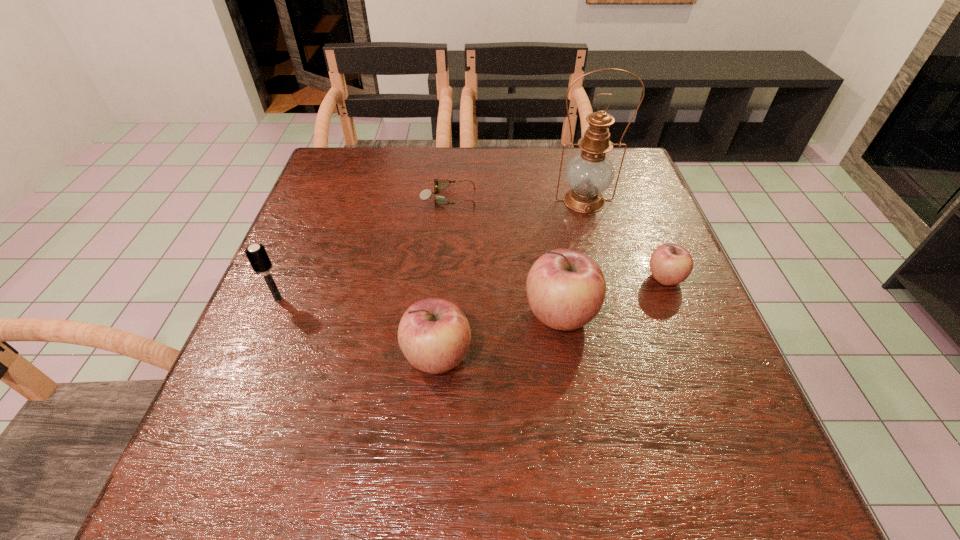
Locate an element on the screen. The height and width of the screenshot is (540, 960). empty space that is in between the tallest object and the shortest apple is located at coordinates [624, 240].

Find the location of `vacant space that is in between the leftmost object and the shortest object`. vacant space that is in between the leftmost object and the shortest object is located at coordinates (363, 248).

You are a GUI agent. You are given a task and a screenshot of the screen. Output one action in this format:
    pyautogui.click(x=<x>, y=<y>)
    Task: Click on the unoccupied position between the leftmost apple and the second apple from right to left
    The height and width of the screenshot is (540, 960).
    Given the screenshot: What is the action you would take?
    pyautogui.click(x=498, y=336)

In order to click on empty space that is in between the leftmost object and the spectacles in this screenshot , I will do `click(363, 248)`.

You are a GUI agent. You are given a task and a screenshot of the screen. Output one action in this format:
    pyautogui.click(x=<x>, y=<y>)
    Task: Click on the vacant region between the tallest object and the second shortest apple
    Image resolution: width=960 pixels, height=540 pixels.
    Given the screenshot: What is the action you would take?
    pyautogui.click(x=511, y=279)

Identify which object is the fourth closest to the rightmost object. Please provide its 2D coordinates. Your answer should be formatted as a tuple, i.e. [(x, y)], where the tuple contains the x and y coordinates of a point satisfying the conditions above.

[(426, 193)]

Point out which object is positioned as the third nearest to the rightmost apple. Please provide its 2D coordinates. Your answer should be formatted as a tuple, i.e. [(x, y)], where the tuple contains the x and y coordinates of a point satisfying the conditions above.

[(434, 334)]

Choose which apple is the nearest neighbor to the second apple from left to right. Please provide its 2D coordinates. Your answer should be formatted as a tuple, i.e. [(x, y)], where the tuple contains the x and y coordinates of a point satisfying the conditions above.

[(434, 334)]

This screenshot has height=540, width=960. What are the coordinates of `apple that is the third closest to the shortest object` in the screenshot? It's located at (670, 264).

Find the location of a particular element. The height and width of the screenshot is (540, 960). vacant point that satisfies the following two spatial constraints: 1. on the front-facing side of the spectacles; 2. on the back side of the leftmost apple is located at coordinates (435, 357).